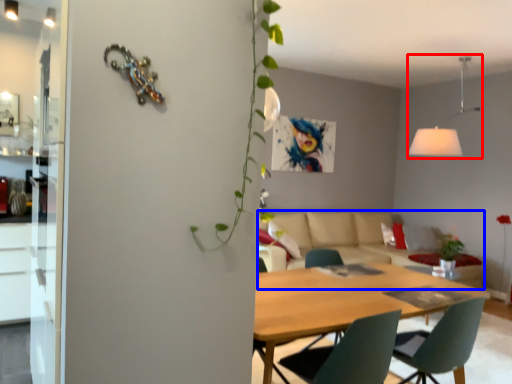
Question: Among these objects, which one is farthest to the camera, light fixture (highlighted by a red box) or couch (highlighted by a blue box)?

Choices:
 (A) light fixture
 (B) couch

Answer: (A)